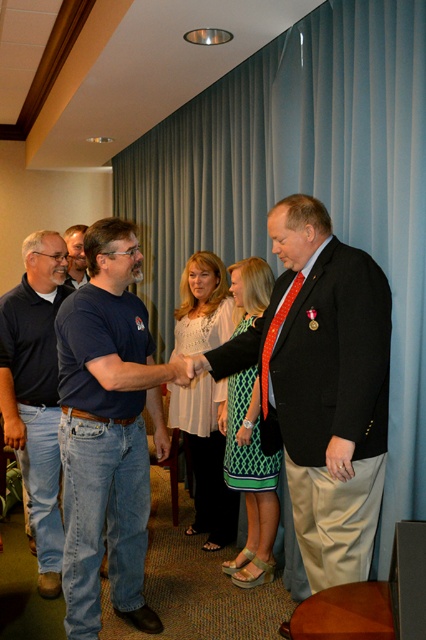
You are standing in the conference room and want to locate the blue fabric curtain at center. What are the coordinates where you should look?

The blue fabric curtain at center is located at coordinates point (305, 186).

You are a photographer in the room and want to capture a wide shot of the scene. Since the blue fabric curtain at center and the denim jeans at left are both in the frame, which object would require more space in the photograph to fully capture its details?

The blue fabric curtain at center requires more space in the photograph to fully capture its details because it is bigger than the denim jeans at left.

You are a photographer in the back of the room. You want to take a photo of the green textured dress at center without the blue fabric curtain at center blocking it. What should you do?

The blue fabric curtain at center is above the green textured dress at center, so you should lower your camera angle to avoid the curtain blocking the dress.